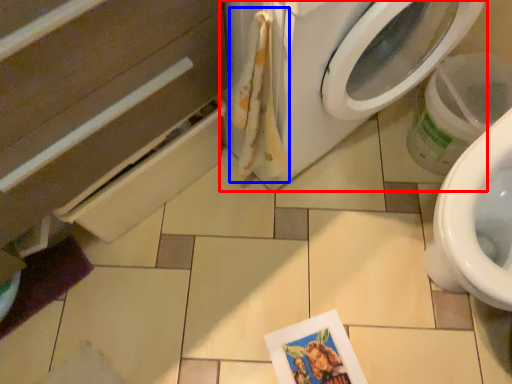
Question: Which point is closer to the camera, washing machine (highlighted by a red box) or laundry (highlighted by a blue box)?

Choices:
 (A) washing machine
 (B) laundry

Answer: (A)